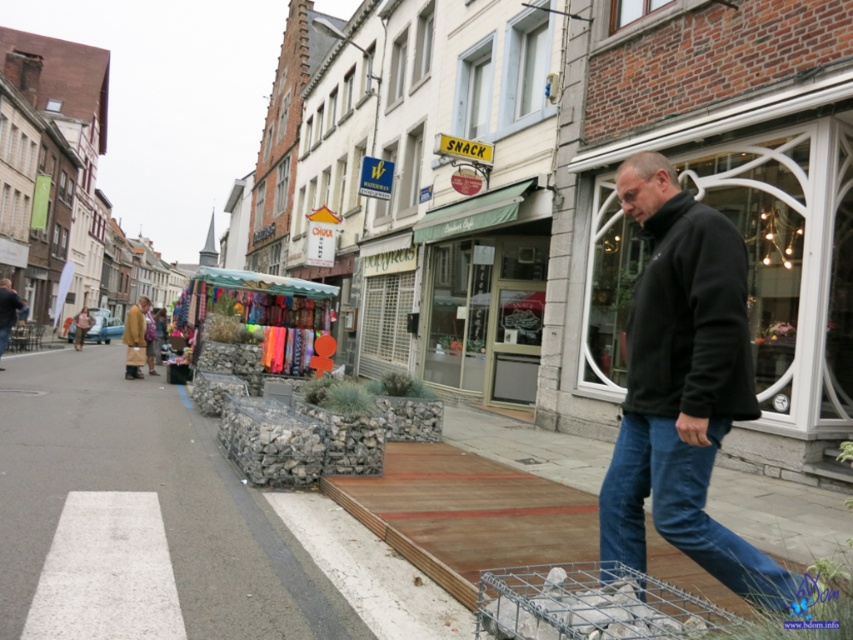
Between gray concrete pavement at lower left and dark brown leather jacket at lower left, which one has less height?

gray concrete pavement at lower left

Is point (100, 483) farther from viewer compared to point (9, 312)?

That is False.

Locate an element on the screen. The height and width of the screenshot is (640, 853). gray concrete pavement at lower left is located at coordinates (148, 492).

Is black fleece jacket at right below light brown leather jacket at lower left?

Incorrect, black fleece jacket at right is not positioned below light brown leather jacket at lower left.

Does black fleece jacket at right lie in front of light brown leather jacket at lower left?

Yes, black fleece jacket at right is closer to the viewer.

This screenshot has height=640, width=853. What do you see at coordinates (689, 317) in the screenshot?
I see `black fleece jacket at right` at bounding box center [689, 317].

Locate an element on the screen. The height and width of the screenshot is (640, 853). black fleece jacket at right is located at coordinates [689, 317].

Is gray concrete pavement at lower left closer to camera compared to wire mesh cart at lower center?

No, it is behind wire mesh cart at lower center.

Is gray concrete pavement at lower left to the right of wire mesh cart at lower center from the viewer's perspective?

Incorrect, gray concrete pavement at lower left is not on the right side of wire mesh cart at lower center.

Does point (178, 461) come in front of point (549, 573)?

No, (178, 461) is behind (549, 573).

Where is `gray concrete pavement at lower left`? The image size is (853, 640). gray concrete pavement at lower left is located at coordinates (148, 492).